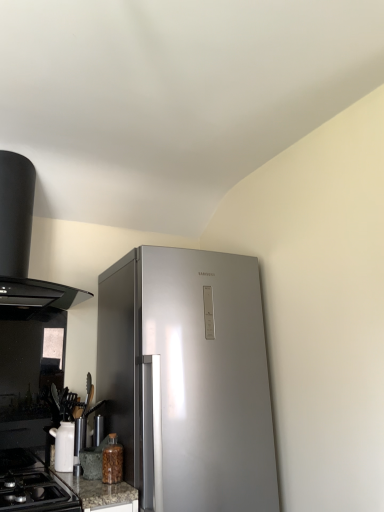
Question: Is white glossy teapot at lower left next to black glass gas stove at lower left?

Choices:
 (A) yes
 (B) no

Answer: (B)

Question: Is white glossy teapot at lower left aimed at black glass gas stove at lower left?

Choices:
 (A) yes
 (B) no

Answer: (B)

Question: Is white glossy teapot at lower left not inside black glass gas stove at lower left?

Choices:
 (A) yes
 (B) no

Answer: (A)

Question: Is white glossy teapot at lower left to the right of black glass gas stove at lower left from the viewer's perspective?

Choices:
 (A) no
 (B) yes

Answer: (B)

Question: Is white glossy teapot at lower left facing away from black glass gas stove at lower left?

Choices:
 (A) no
 (B) yes

Answer: (A)

Question: Considering the positions of point (4, 260) and point (61, 464), is point (4, 260) closer or farther from the camera than point (61, 464)?

Choices:
 (A) closer
 (B) farther

Answer: (A)

Question: Considering the positions of black matte range hood at upper left and white glossy teapot at lower left in the image, is black matte range hood at upper left bigger or smaller than white glossy teapot at lower left?

Choices:
 (A) small
 (B) big

Answer: (B)

Question: From the image's perspective, relative to white glossy teapot at lower left, is black matte range hood at upper left above or below?

Choices:
 (A) below
 (B) above

Answer: (B)

Question: Would you say black matte range hood at upper left is to the left or to the right of white glossy teapot at lower left in the picture?

Choices:
 (A) left
 (B) right

Answer: (A)

Question: In terms of width, does black glass gas stove at lower left look wider or thinner when compared to translucent glass jar at lower left?

Choices:
 (A) thin
 (B) wide

Answer: (B)

Question: From a real-world perspective, is black glass gas stove at lower left above or below translucent glass jar at lower left?

Choices:
 (A) above
 (B) below

Answer: (B)

Question: Based on their sizes in the image, would you say black glass gas stove at lower left is bigger or smaller than translucent glass jar at lower left?

Choices:
 (A) big
 (B) small

Answer: (A)

Question: From the image's perspective, is black glass gas stove at lower left above or below translucent glass jar at lower left?

Choices:
 (A) below
 (B) above

Answer: (A)

Question: From a real-world perspective, relative to black matte range hood at upper left, is translucent glass jar at lower left vertically above or below?

Choices:
 (A) above
 (B) below

Answer: (B)

Question: Is translucent glass jar at lower left bigger or smaller than black matte range hood at upper left?

Choices:
 (A) small
 (B) big

Answer: (A)